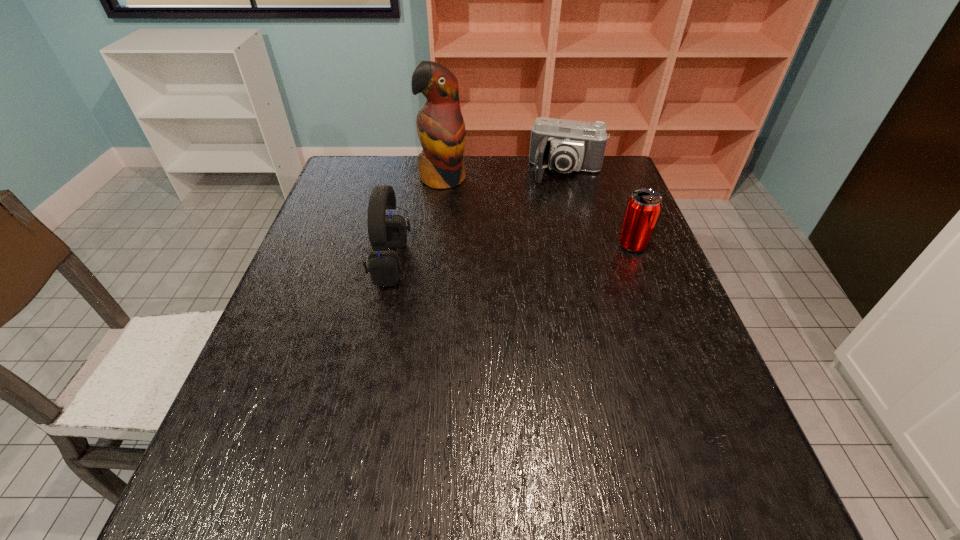
Where is `vacant area between the camera and the tallest object`? The width and height of the screenshot is (960, 540). vacant area between the camera and the tallest object is located at coordinates (505, 176).

The height and width of the screenshot is (540, 960). I want to click on blank region between the parrot and the third shortest object, so click(418, 221).

Locate an element on the screen. The image size is (960, 540). vacant area between the second tallest object and the parrot is located at coordinates (418, 221).

Identify the location of blank region between the third shortest object and the soda can. (512, 254).

This screenshot has width=960, height=540. Find the location of `free space between the soda can and the camera`. free space between the soda can and the camera is located at coordinates (599, 208).

You are a GUI agent. You are given a task and a screenshot of the screen. Output one action in this format:
    pyautogui.click(x=<x>, y=<y>)
    Task: Click on the unoccupied position between the camera and the second tallest object
    
    Given the screenshot: What is the action you would take?
    pyautogui.click(x=479, y=217)

Choose which object is the nearest neighbor to the soda can. Please provide its 2D coordinates. Your answer should be formatted as a tuple, i.e. [(x, y)], where the tuple contains the x and y coordinates of a point satisfying the conditions above.

[(563, 145)]

What are the coordinates of `object that stands as the closest to the tallest object` in the screenshot? It's located at (563, 145).

Image resolution: width=960 pixels, height=540 pixels. In order to click on free space in the image that satisfies the following two spatial constraints: 1. on the front side of the soda can; 2. on the left side of the parrot in this screenshot , I will do `click(436, 245)`.

The width and height of the screenshot is (960, 540). I want to click on vacant space that satisfies the following two spatial constraints: 1. on the back side of the camera; 2. on the right side of the tallest object, so click(x=444, y=172).